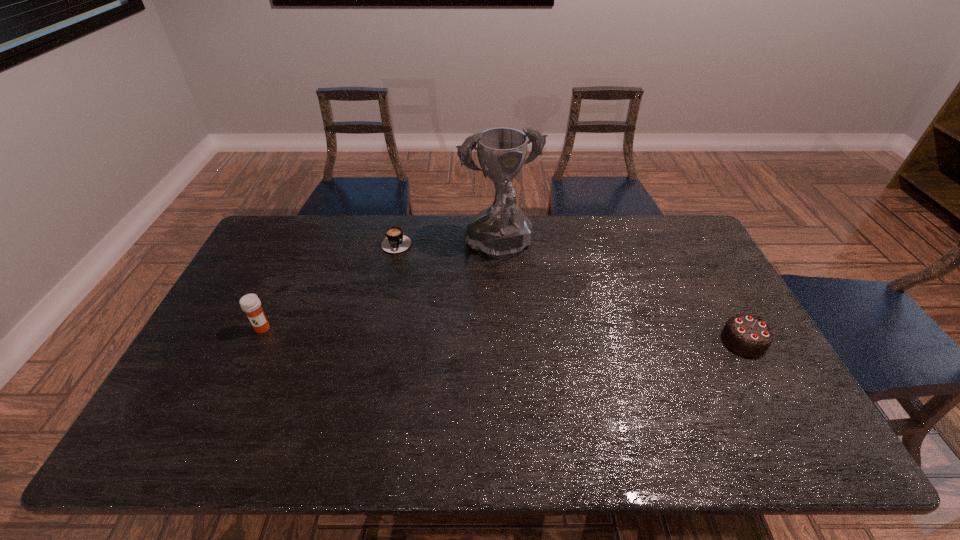
In order to click on free space between the award and the leftmost object in this screenshot , I will do `click(381, 289)`.

The image size is (960, 540). Find the location of `free space that is in between the medicine and the third object from left to right`. free space that is in between the medicine and the third object from left to right is located at coordinates (381, 289).

What are the coordinates of `free point between the tallest object and the cappuccino` in the screenshot? It's located at (448, 245).

Where is `vacant space in between the medicine and the chocolate cake`? vacant space in between the medicine and the chocolate cake is located at coordinates (503, 334).

Locate an element on the screen. unoccupied position between the second shortest object and the shortest object is located at coordinates (570, 291).

Where is `free space between the second shortest object and the second tallest object`? The height and width of the screenshot is (540, 960). free space between the second shortest object and the second tallest object is located at coordinates (503, 334).

At what (x,y) coordinates should I click in order to perform the action: click on empty space that is in between the third object from left to right and the third object from right to left. Please return your answer as a coordinate pair (x, y). This screenshot has width=960, height=540. Looking at the image, I should click on (448, 245).

Identify which object is the closest to the third object from right to left. Please provide its 2D coordinates. Your answer should be formatted as a tuple, i.e. [(x, y)], where the tuple contains the x and y coordinates of a point satisfying the conditions above.

[(502, 230)]

The height and width of the screenshot is (540, 960). I want to click on object that is the second closest one to the award, so click(x=750, y=336).

Identify the location of free region that satisfies the following two spatial constraints: 1. on the front side of the award; 2. on the right side of the cappuccino. This screenshot has height=540, width=960. (396, 249).